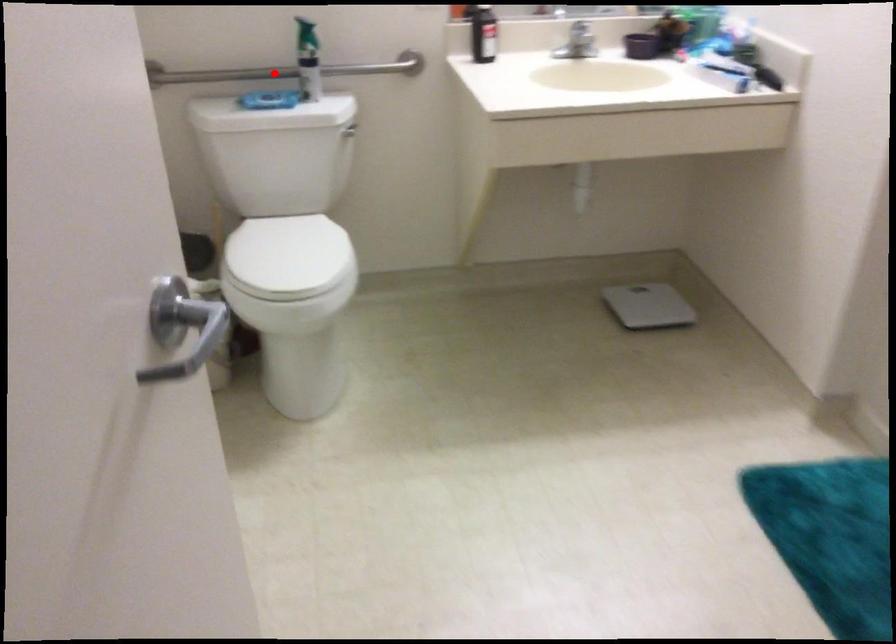
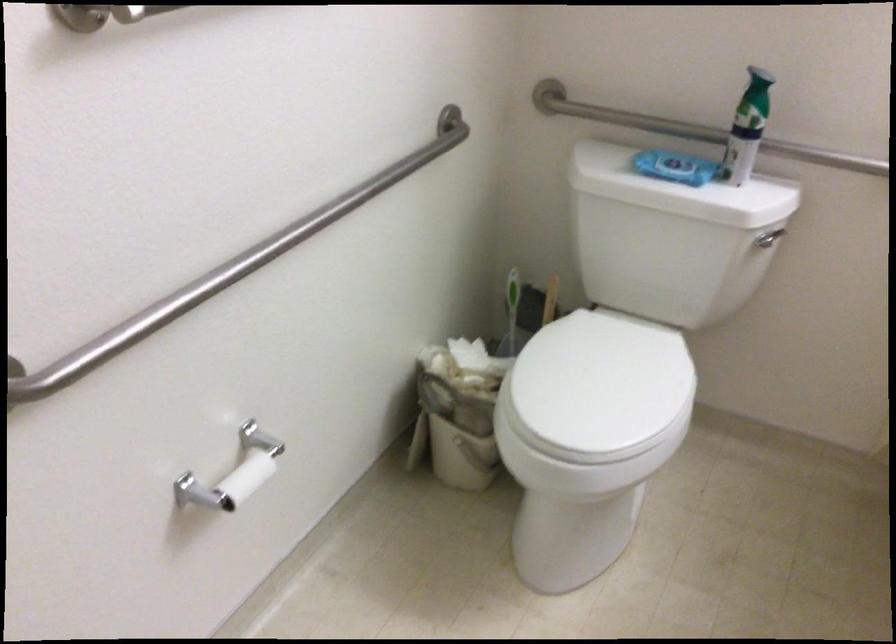
Where in the second image is the point corresponding to the highlighted location from the first image?

(691, 129)